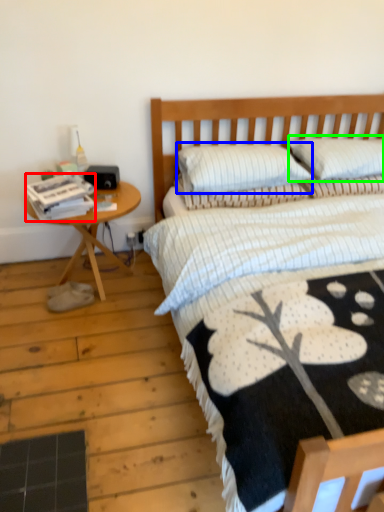
Question: Considering the real-world distances, which object is closest to magazine (highlighted by a red box)? pillow (highlighted by a blue box) or pillow (highlighted by a green box).

Choices:
 (A) pillow
 (B) pillow

Answer: (A)